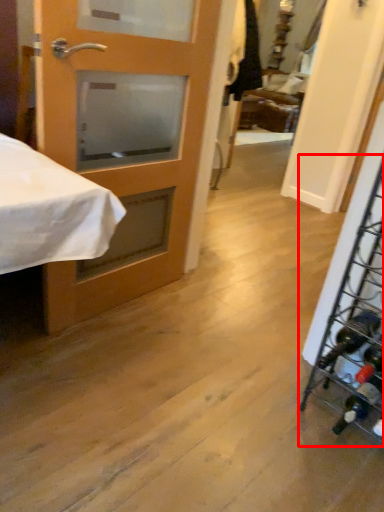
Question: From the image, what is the correct spatial relationship of wine rack (annotated by the red box) in relation to door?

Choices:
 (A) left
 (B) right

Answer: (B)